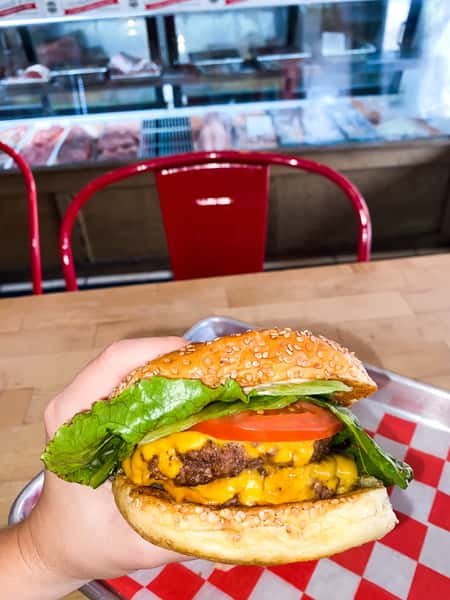
You are a GUI agent. You are given a task and a screenshot of the screen. Output one action in this format:
    pyautogui.click(x=<x>, y=<y>)
    Task: Click on the tray
    The height and width of the screenshot is (600, 450).
    Given the screenshot: What is the action you would take?
    pyautogui.click(x=228, y=323)